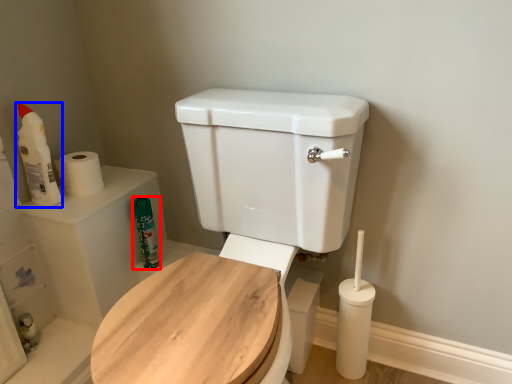
Question: Which point is closer to the camera, cleaning product (highlighted by a red box) or cleaning product (highlighted by a blue box)?

Choices:
 (A) cleaning product
 (B) cleaning product

Answer: (B)